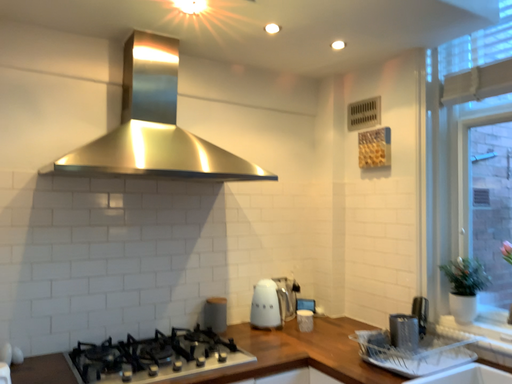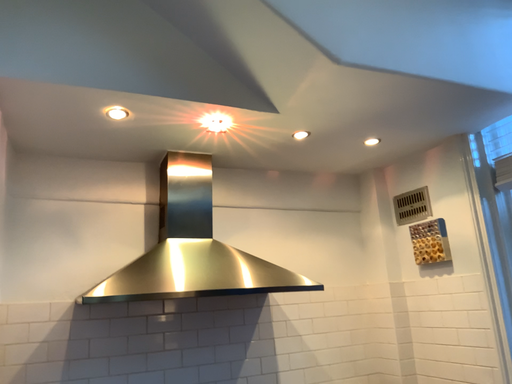
Question: How did the camera likely rotate when shooting the video?

Choices:
 (A) rotated upward
 (B) rotated downward

Answer: (A)